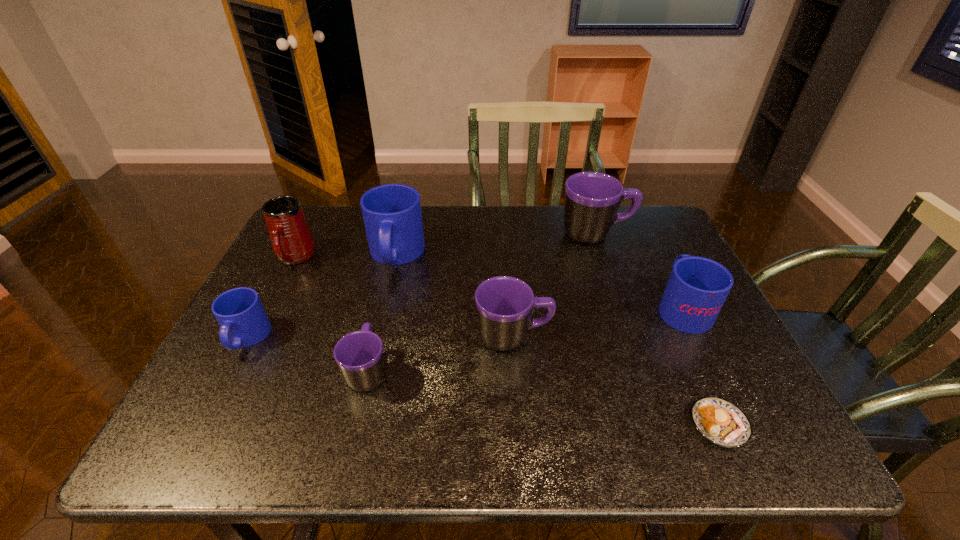
In the image, there is a desktop. What are the coordinates of `vacant space at the near edge` in the screenshot? It's located at (539, 437).

The image size is (960, 540). In order to click on vacant space at the left edge of the desktop in this screenshot , I will do `click(295, 292)`.

At what (x,y) coordinates should I click in order to perform the action: click on free region at the right edge of the desktop. Please return your answer as a coordinate pair (x, y). Image resolution: width=960 pixels, height=540 pixels. Looking at the image, I should click on (673, 357).

This screenshot has width=960, height=540. I want to click on blank space at the near left corner, so click(256, 434).

In the image, there is a desktop. Where is `vacant space at the far right corner`? This screenshot has width=960, height=540. vacant space at the far right corner is located at coordinates coord(657,214).

This screenshot has height=540, width=960. What are the coordinates of `free area in between the brown pastry and the fourth object from right to left` in the screenshot? It's located at (616, 381).

Locate an element on the screen. Image resolution: width=960 pixels, height=540 pixels. free spot between the second blue mug from left to right and the leftmost blue mug is located at coordinates (322, 296).

Locate an element on the screen. The width and height of the screenshot is (960, 540). empty location between the leftmost black mug and the rightmost blue mug is located at coordinates (x=525, y=339).

Where is `vacant area between the rightmost blue mug and the smallest blue mug`? vacant area between the rightmost blue mug and the smallest blue mug is located at coordinates (465, 323).

This screenshot has height=540, width=960. Find the location of `free space between the brown pastry and the third mug from right to left`. free space between the brown pastry and the third mug from right to left is located at coordinates (616, 381).